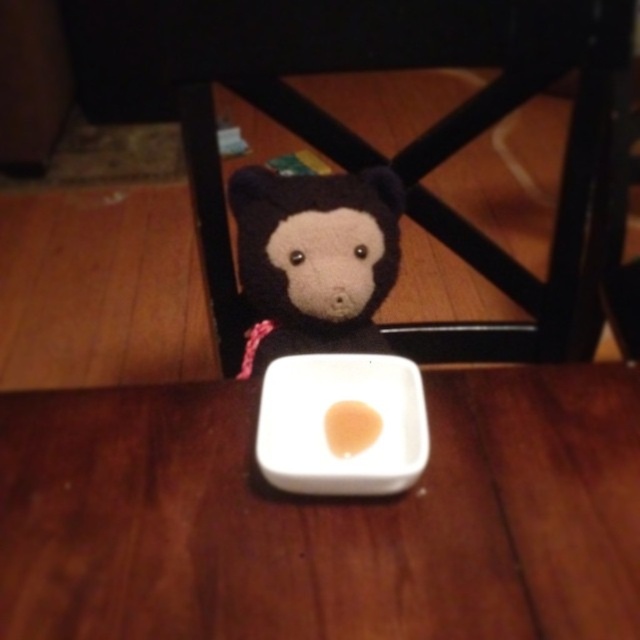
Question: Is wooden table at center above white matte plate at center?

Choices:
 (A) no
 (B) yes

Answer: (B)

Question: From the image, what is the correct spatial relationship of soft plush bear at center in relation to white matte plate at center?

Choices:
 (A) right
 (B) left

Answer: (B)

Question: Which of the following is the farthest from the observer?

Choices:
 (A) (602, 422)
 (B) (330, 412)
 (C) (312, 218)
 (D) (305, 440)

Answer: (C)

Question: Estimate the real-world distances between objects in this image. Which object is closer to the smooth beige rice at center?

Choices:
 (A) white matte square plate at center
 (B) soft plush bear at center
 (C) white matte plate at center

Answer: (C)

Question: Observing the image, what is the correct spatial positioning of white matte square plate at center in reference to wooden table at center?

Choices:
 (A) right
 (B) left

Answer: (B)

Question: Which point is closer to the camera?

Choices:
 (A) soft plush bear at center
 (B) white matte plate at center

Answer: (B)